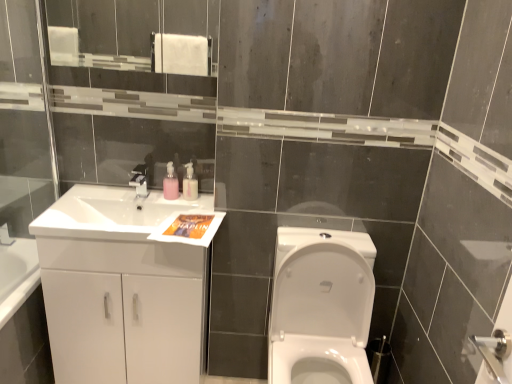
Find the location of a particular element. The height and width of the screenshot is (384, 512). white glossy sink at left is located at coordinates (111, 213).

This screenshot has height=384, width=512. What do you see at coordinates (190, 183) in the screenshot? I see `pink plastic soap dispenser at upper center, marked as the first soap dispenser in a right-to-left arrangement` at bounding box center [190, 183].

Describe the element at coordinates (121, 289) in the screenshot. I see `white glossy cabinet at left` at that location.

Image resolution: width=512 pixels, height=384 pixels. What do you see at coordinates (140, 180) in the screenshot?
I see `matte silver faucet at upper center` at bounding box center [140, 180].

In order to face matte silver faucet at upper center, should I rotate leftwards or rightwards?

Turn left by 15.198 degrees to look at matte silver faucet at upper center.

The width and height of the screenshot is (512, 384). I want to click on white glossy toilet at center, so click(321, 306).

From a real-world perspective, relative to matte silver faucet at upper center, is transparent glass door at left vertically above or below?

transparent glass door at left is above matte silver faucet at upper center.

I want to click on glass door located above the matte silver faucet at upper center (from the image's perspective), so click(25, 117).

Looking at this image, is there a large distance between transparent glass door at left and matte silver faucet at upper center?

That's not correct — transparent glass door at left is a little close to matte silver faucet at upper center.

Who is bigger, transparent glass door at left or matte silver faucet at upper center?

Bigger between the two is transparent glass door at left.

Between transparent glass door at left and pink plastic soap dispenser at upper center, marked as the first soap dispenser in a right-to-left arrangement, which one has larger width?

pink plastic soap dispenser at upper center, marked as the first soap dispenser in a right-to-left arrangement, is wider.

How much distance is there between transparent glass door at left and pink plastic soap dispenser at upper center, marked as the 2th soap dispenser in a left-to-right arrangement?

transparent glass door at left and pink plastic soap dispenser at upper center, marked as the 2th soap dispenser in a left-to-right arrangement, are 27.60 inches apart from each other.

Based on their sizes in the image, would you say transparent glass door at left is bigger or smaller than pink plastic soap dispenser at upper center, marked as the 2th soap dispenser in a left-to-right arrangement?

Considering their sizes, transparent glass door at left takes up more space than pink plastic soap dispenser at upper center, marked as the 2th soap dispenser in a left-to-right arrangement.

Locate an element on the screen. This screenshot has width=512, height=384. glass door in front of the pink plastic soap dispenser at upper center, marked as the 2th soap dispenser in a left-to-right arrangement is located at coordinates (25, 117).

Are white glossy toilet at center and matte silver faucet at upper center far apart?

No, white glossy toilet at center is not far away from matte silver faucet at upper center.

Between white glossy toilet at center and matte silver faucet at upper center, which one has more height?

Standing taller between the two is white glossy toilet at center.

How many degrees apart are the facing directions of white glossy toilet at center and matte silver faucet at upper center?

The facing directions of white glossy toilet at center and matte silver faucet at upper center are 1.49 degrees apart.

Between white glossy toilet at center and matte silver faucet at upper center, which one appears on the left side from the viewer's perspective?

From the viewer's perspective, matte silver faucet at upper center appears more on the left side.

Image resolution: width=512 pixels, height=384 pixels. Find the location of `the 1st soap dispenser located above the white glossy toilet at center (from a real-world perspective)`. the 1st soap dispenser located above the white glossy toilet at center (from a real-world perspective) is located at coordinates point(170,183).

In the scene shown: Is pink matte soap dispenser at upper center, positioned as the 2th soap dispenser in right-to-left order, bigger or smaller than white glossy toilet at center?

pink matte soap dispenser at upper center, positioned as the 2th soap dispenser in right-to-left order, is smaller than white glossy toilet at center.

Is pink matte soap dispenser at upper center, arranged as the 1th soap dispenser when viewed from the left, next to white glossy toilet at center and touching it?

They are not placed beside each other.

How much distance is there between white glossy sink at left and matte silver faucet at upper center?

A distance of 8.80 inches exists between white glossy sink at left and matte silver faucet at upper center.

Between white glossy sink at left and matte silver faucet at upper center, which one has larger width?

white glossy sink at left.

From the image's perspective, is white glossy sink at left on matte silver faucet at upper center?

Actually, white glossy sink at left appears below matte silver faucet at upper center in the image.

Is white glossy sink at left shorter than matte silver faucet at upper center?

In fact, white glossy sink at left may be taller than matte silver faucet at upper center.

Considering the sizes of pink plastic soap dispenser at upper center, marked as the 2th soap dispenser in a left-to-right arrangement, and transparent glass door at left in the image, is pink plastic soap dispenser at upper center, marked as the 2th soap dispenser in a left-to-right arrangement, taller or shorter than transparent glass door at left?

Clearly, pink plastic soap dispenser at upper center, marked as the 2th soap dispenser in a left-to-right arrangement, is shorter compared to transparent glass door at left.

Which of these two, pink plastic soap dispenser at upper center, marked as the first soap dispenser in a right-to-left arrangement, or transparent glass door at left, is wider?

Wider between the two is pink plastic soap dispenser at upper center, marked as the first soap dispenser in a right-to-left arrangement.

Is white glossy sink at left a part of white glossy cabinet at left?

Yes, white glossy sink at left is inside white glossy cabinet at left.

From a real-world perspective, is white glossy cabinet at left positioned above or below white glossy sink at left?

Clearly, from a real-world perspective, white glossy cabinet at left is below white glossy sink at left.

In the scene shown: Considering the relative sizes of white glossy cabinet at left and white glossy sink at left in the image provided, is white glossy cabinet at left taller than white glossy sink at left?

Correct, white glossy cabinet at left is much taller as white glossy sink at left.

From the image's perspective, is white glossy cabinet at left beneath white glossy sink at left?

Yes, from the image's perspective, white glossy cabinet at left is below white glossy sink at left.

Where is `tap on the right of transparent glass door at left`? The width and height of the screenshot is (512, 384). tap on the right of transparent glass door at left is located at coordinates (140, 180).

This screenshot has width=512, height=384. Identify the location of glass door above the pink plastic soap dispenser at upper center, marked as the 2th soap dispenser in a left-to-right arrangement (from a real-world perspective). (25, 117).

From the image, which object appears to be farther from white glossy cabinet at left, matte silver faucet at upper center or pink plastic soap dispenser at upper center, marked as the 2th soap dispenser in a left-to-right arrangement?

Among the two, pink plastic soap dispenser at upper center, marked as the 2th soap dispenser in a left-to-right arrangement, is located further to white glossy cabinet at left.

Based on their spatial positions, is transparent glass door at left or pink plastic soap dispenser at upper center, marked as the first soap dispenser in a right-to-left arrangement, further from white glossy sink at left?

The object further to white glossy sink at left is transparent glass door at left.

When comparing their distances from white glossy cabinet at left, does matte silver faucet at upper center or white glossy sink at left seem further?

matte silver faucet at upper center is further to white glossy cabinet at left.

When comparing their distances from white glossy sink at left, does transparent glass door at left or white glossy toilet at center seem further?

white glossy toilet at center is further to white glossy sink at left.

Which object lies nearer to the anchor point pink plastic soap dispenser at upper center, marked as the 2th soap dispenser in a left-to-right arrangement, white glossy sink at left or pink matte soap dispenser at upper center, positioned as the 2th soap dispenser in right-to-left order?

pink matte soap dispenser at upper center, positioned as the 2th soap dispenser in right-to-left order.

From the image, which object appears to be nearer to transparent glass door at left, matte silver faucet at upper center or pink matte soap dispenser at upper center, positioned as the 2th soap dispenser in right-to-left order?

matte silver faucet at upper center lies closer to transparent glass door at left than the other object.

Based on their spatial positions, is pink plastic soap dispenser at upper center, marked as the 2th soap dispenser in a left-to-right arrangement, or matte silver faucet at upper center further from transparent glass door at left?

Based on the image, pink plastic soap dispenser at upper center, marked as the 2th soap dispenser in a left-to-right arrangement, appears to be further to transparent glass door at left.

Based on their spatial positions, is pink plastic soap dispenser at upper center, marked as the 2th soap dispenser in a left-to-right arrangement, or white glossy toilet at center closer to transparent glass door at left?

pink plastic soap dispenser at upper center, marked as the 2th soap dispenser in a left-to-right arrangement, is positioned closer to the anchor transparent glass door at left.

Locate an element on the screen. The height and width of the screenshot is (384, 512). sink between transparent glass door at left and pink matte soap dispenser at upper center, positioned as the 2th soap dispenser in right-to-left order, along the z-axis is located at coordinates (111, 213).

You are a GUI agent. You are given a task and a screenshot of the screen. Output one action in this format:
    pyautogui.click(x=<x>, y=<y>)
    Task: Click on the sink between pink plastic soap dispenser at upper center, marked as the 2th soap dispenser in a left-to-right arrangement, and white glossy cabinet at left from top to bottom
    
    Given the screenshot: What is the action you would take?
    pyautogui.click(x=111, y=213)

Locate an element on the screen. This screenshot has width=512, height=384. sink between transparent glass door at left and white glossy toilet at center is located at coordinates (111, 213).

Identify the location of tap located between white glossy sink at left and pink plastic soap dispenser at upper center, marked as the 2th soap dispenser in a left-to-right arrangement, in the depth direction. [140, 180].